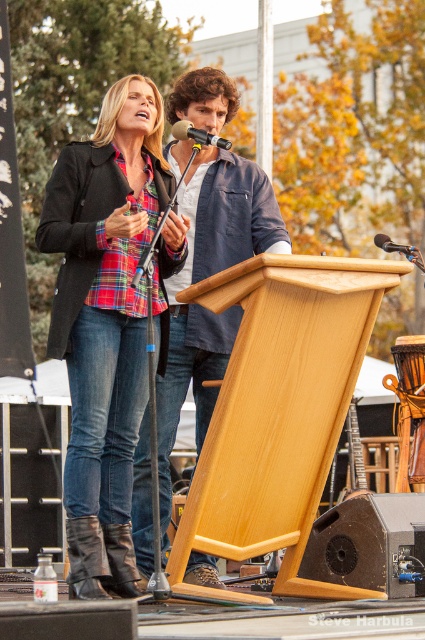
How distant is plaid fabric shirt at center from wooden podium at center?

plaid fabric shirt at center is 1.68 meters away from wooden podium at center.

Is plaid fabric shirt at center thinner than wooden podium at center?

Correct, plaid fabric shirt at center's width is less than wooden podium at center's.

Does point (121, 333) come closer to viewer compared to point (142, 420)?

Yes.

The image size is (425, 640). Identify the location of plaid fabric shirt at center. (104, 308).

Who is positioned more to the right, natural wood podium at center or leather boots at lower left?

natural wood podium at center

Does natural wood podium at center have a greater width compared to leather boots at lower left?

Yes.

The height and width of the screenshot is (640, 425). What do you see at coordinates (278, 410) in the screenshot?
I see `natural wood podium at center` at bounding box center [278, 410].

In order to click on natural wood podium at center in this screenshot , I will do `click(278, 410)`.

Between point (336, 333) and point (402, 536), which one is positioned behind?

Point (336, 333)

The height and width of the screenshot is (640, 425). Describe the element at coordinates (278, 410) in the screenshot. I see `natural wood podium at center` at that location.

Is point (299, 326) positioned after point (414, 580)?

Yes, it is.

Locate an element on the screen. The image size is (425, 640). natural wood podium at center is located at coordinates (278, 410).